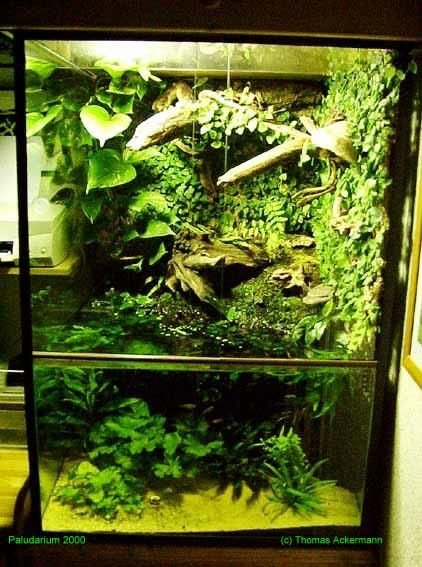
Where is `cabinet`? The width and height of the screenshot is (422, 567). cabinet is located at coordinates (220, 553).